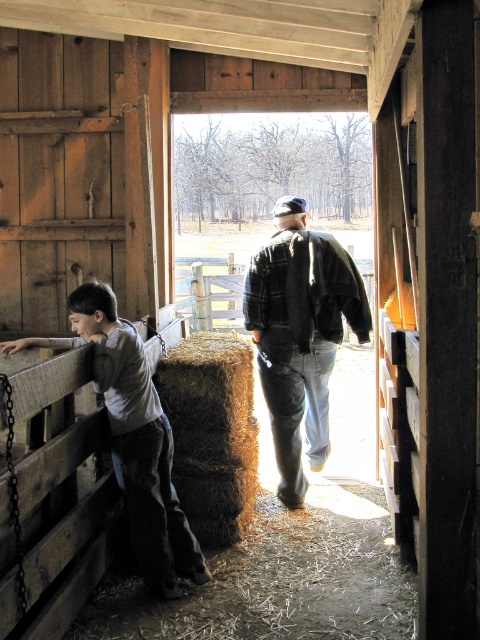
You are a farmer checking the barn. You see the light brown wooden fence at left and the brown rough hay at center. Which object is taller?

The light brown wooden fence at left is taller than the brown rough hay at center.

You are a visitor in the barn and want to place a new coat hanger exactly between the flannel jacket at center and the light brown wooden fence at left. Which object should you place the hanger closer to?

The flannel jacket at center is to the right of the light brown wooden fence at left. Therefore, to place the hanger exactly between them, it should be closer to the light brown wooden fence at left.

You are standing in the barn and want to pick up the flannel jacket at center. Where should you look to find it?

The flannel jacket at center is located at the coordinates point (x=300, y=333).